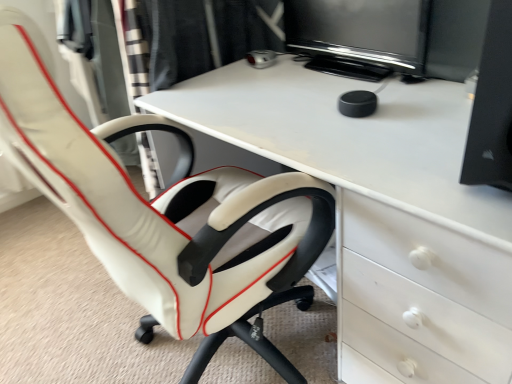
In order to face black glossy monitor at upper center, should I rotate leftwards or rightwards?

It's best to rotate right around 11.806 degrees.

This screenshot has width=512, height=384. Identify the location of black glossy monitor at upper center. (359, 36).

From the image's perspective, is white glossy desk at center on white leather chair at left?

Incorrect, from the image's perspective, white glossy desk at center is lower than white leather chair at left.

Considering the points (225, 124) and (6, 141), which point is behind, point (225, 124) or point (6, 141)?

The point (225, 124) is more distant.

How different are the orientations of white glossy desk at center and white leather chair at left in degrees?

178 degrees separate the facing orientations of white glossy desk at center and white leather chair at left.

Looking at this image, considering the sizes of objects white glossy desk at center and white leather chair at left in the image provided, who is bigger, white glossy desk at center or white leather chair at left?

white glossy desk at center.

Which object is closer to the camera taking this photo, white leather chair at left or black glossy monitor at upper center?

white leather chair at left.

This screenshot has width=512, height=384. Identify the location of chair lying below the black glossy monitor at upper center (from the image's perspective). (165, 213).

Consider the image. Is white leather chair at left directly adjacent to black glossy monitor at upper center?

white leather chair at left is not next to black glossy monitor at upper center, and they're not touching.

Which of these two, black glossy monitor at upper center or white glossy desk at center, stands taller?

Standing taller between the two is white glossy desk at center.

Is black glossy monitor at upper center bigger than white glossy desk at center?

No, black glossy monitor at upper center is not bigger than white glossy desk at center.

Is black glossy monitor at upper center outside of white glossy desk at center?

Absolutely, black glossy monitor at upper center is external to white glossy desk at center.

Find the location of a particular element. The height and width of the screenshot is (384, 512). desk below the black glossy monitor at upper center (from the image's perspective) is located at coordinates pyautogui.click(x=381, y=211).

Is point (410, 36) less distant than point (282, 377)?

Yes, point (410, 36) is closer to viewer.

From a real-world perspective, is black glossy monitor at upper center physically below white leather chair at left?

No, from a real-world perspective, black glossy monitor at upper center is not beneath white leather chair at left.

Is black glossy monitor at upper center looking in the opposite direction of white leather chair at left?

No.

Based on the photo, can we say black glossy monitor at upper center lies outside white leather chair at left?

That's correct, black glossy monitor at upper center is outside of white leather chair at left.

From a real-world perspective, which object rests below the other?

white glossy desk at center is physically lower.

Is white glossy desk at center directly adjacent to black glossy monitor at upper center?

No, white glossy desk at center is not next to black glossy monitor at upper center.

Is white glossy desk at center oriented away from black glossy monitor at upper center?

No, white glossy desk at center's orientation is not away from black glossy monitor at upper center.

Is white leather chair at left looking in the opposite direction of white glossy desk at center?

No, white leather chair at left's orientation is not away from white glossy desk at center.

From the image's perspective, between white leather chair at left and white glossy desk at center, which one is located above?

white leather chair at left is shown above in the image.

Considering their positions, is white leather chair at left located in front of or behind white glossy desk at center?

white leather chair at left is in front of white glossy desk at center.

Where is `chair lying in front of the white glossy desk at center`? chair lying in front of the white glossy desk at center is located at coordinates (165, 213).

Where is `computer monitor behind the white leather chair at left`? Image resolution: width=512 pixels, height=384 pixels. computer monitor behind the white leather chair at left is located at coordinates (359, 36).

Looking at the image, which one is located closer to white leather chair at left, black glossy monitor at upper center or white glossy desk at center?

The object closer to white leather chair at left is white glossy desk at center.

Which object lies nearer to the anchor point white glossy desk at center, white leather chair at left or black glossy monitor at upper center?

white leather chair at left is positioned closer to the anchor white glossy desk at center.

Based on the photo, based on their spatial positions, is white glossy desk at center or black glossy monitor at upper center closer to white leather chair at left?

Based on the image, white glossy desk at center appears to be nearer to white leather chair at left.

Based on their spatial positions, is white glossy desk at center or white leather chair at left closer to black glossy monitor at upper center?

Based on the image, white glossy desk at center appears to be nearer to black glossy monitor at upper center.

From the image, which object appears to be farther from black glossy monitor at upper center, white leather chair at left or white glossy desk at center?

white leather chair at left lies further to black glossy monitor at upper center than the other object.

Estimate the real-world distances between objects in this image. Which object is closer to white glossy desk at center, black glossy monitor at upper center or white leather chair at left?

Based on the image, white leather chair at left appears to be nearer to white glossy desk at center.

This screenshot has width=512, height=384. In order to click on desk between white leather chair at left and black glossy monitor at upper center along the z-axis in this screenshot , I will do [381, 211].